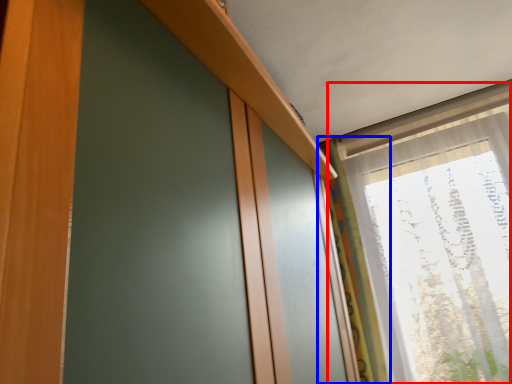
Question: Which of the following is the farthest to the observer, window (highlighted by a red box) or curtain (highlighted by a blue box)?

Choices:
 (A) window
 (B) curtain

Answer: (B)